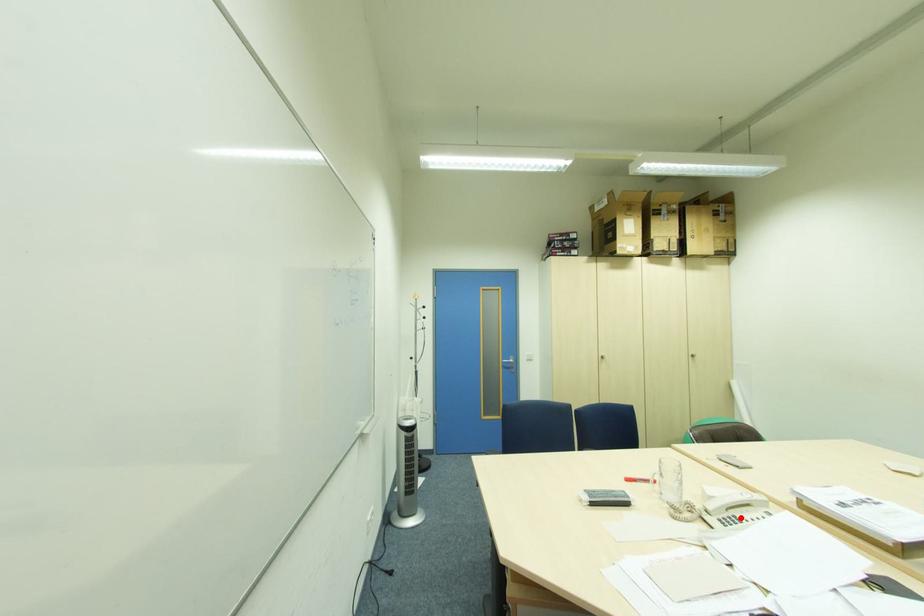
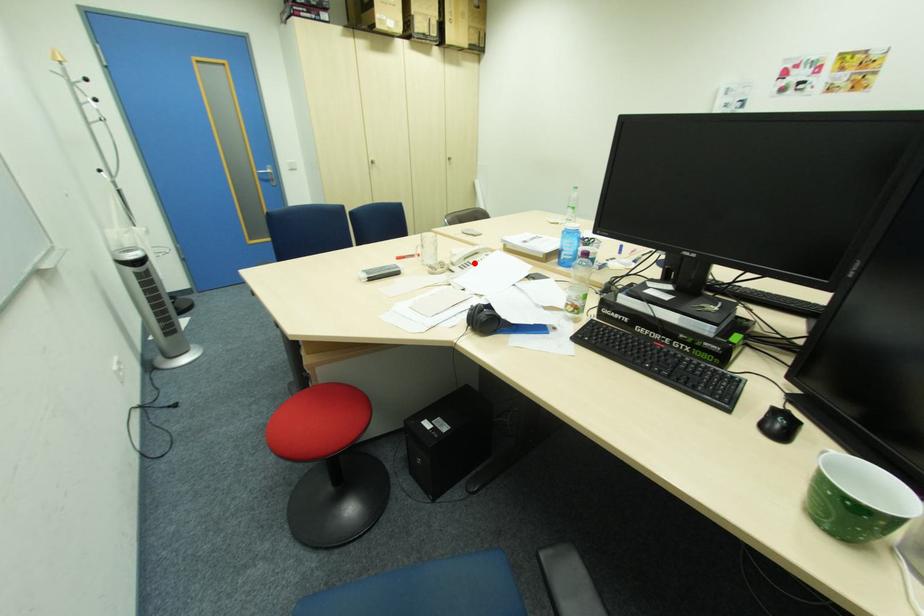
I am providing you with two images of the same scene from different viewpoints. A red point is marked on the first image and another point is marked on the second image. Does the point marked in image1 correspond to the same location as the one in image2?

Yes